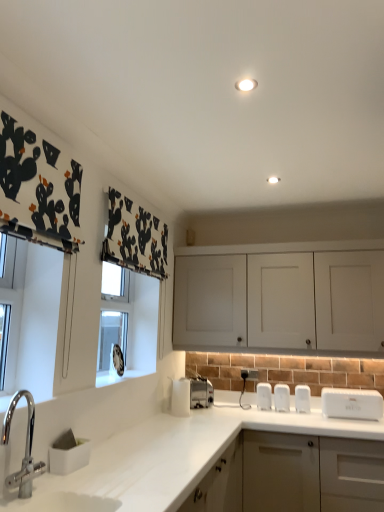
Question: In which direction should I rotate to look at white plastic electric outlet at lower center?

Choices:
 (A) right
 (B) left

Answer: (A)

Question: Considering the relative positions of white plastic salt and pepper shakers at center, which is the second appliance from left to right, and brushed metal faucet at lower left in the image provided, is white plastic salt and pepper shakers at center, which is the second appliance from left to right, in front of brushed metal faucet at lower left?

Choices:
 (A) no
 (B) yes

Answer: (A)

Question: From the image's perspective, is white plastic salt and pepper shakers at center, placed as the 2th appliance when sorted from right to left, above brushed metal faucet at lower left?

Choices:
 (A) yes
 (B) no

Answer: (B)

Question: From a real-world perspective, is white plastic salt and pepper shakers at center, which is the second appliance from left to right, below brushed metal faucet at lower left?

Choices:
 (A) no
 (B) yes

Answer: (B)

Question: Can you confirm if white plastic salt and pepper shakers at center, placed as the 2th appliance when sorted from right to left, is bigger than brushed metal faucet at lower left?

Choices:
 (A) yes
 (B) no

Answer: (B)

Question: Can you confirm if white plastic salt and pepper shakers at center, placed as the 2th appliance when sorted from right to left, is shorter than brushed metal faucet at lower left?

Choices:
 (A) yes
 (B) no

Answer: (B)

Question: Is white plastic salt and pepper shakers at center, which is the second appliance from left to right, looking in the opposite direction of brushed metal faucet at lower left?

Choices:
 (A) no
 (B) yes

Answer: (A)

Question: Is white plastic electric outlet at lower center oriented away from matte white cabinet at lower right, placed as the first cabinetry when sorted from bottom to top?

Choices:
 (A) yes
 (B) no

Answer: (B)

Question: Can you confirm if white plastic electric outlet at lower center is taller than matte white cabinet at lower right, placed as the first cabinetry when sorted from bottom to top?

Choices:
 (A) yes
 (B) no

Answer: (B)

Question: Can you confirm if white plastic electric outlet at lower center is smaller than matte white cabinet at lower right, arranged as the 2th cabinetry when viewed from the top?

Choices:
 (A) yes
 (B) no

Answer: (A)

Question: Does white plastic electric outlet at lower center appear on the right side of matte white cabinet at lower right, placed as the first cabinetry when sorted from bottom to top?

Choices:
 (A) no
 (B) yes

Answer: (A)

Question: Considering the relative positions of white plastic electric outlet at lower center and matte white cabinet at lower right, placed as the first cabinetry when sorted from bottom to top, in the image provided, is white plastic electric outlet at lower center to the left of matte white cabinet at lower right, placed as the first cabinetry when sorted from bottom to top, from the viewer's perspective?

Choices:
 (A) no
 (B) yes

Answer: (B)

Question: Is white plastic electric outlet at lower center aimed at matte white cabinet at lower right, placed as the first cabinetry when sorted from bottom to top?

Choices:
 (A) yes
 (B) no

Answer: (B)

Question: Is matte white cabinet at lower right, arranged as the 2th cabinetry when viewed from the top, positioned in front of white plastic salt and pepper shakers at center, which is the second appliance from left to right?

Choices:
 (A) yes
 (B) no

Answer: (A)